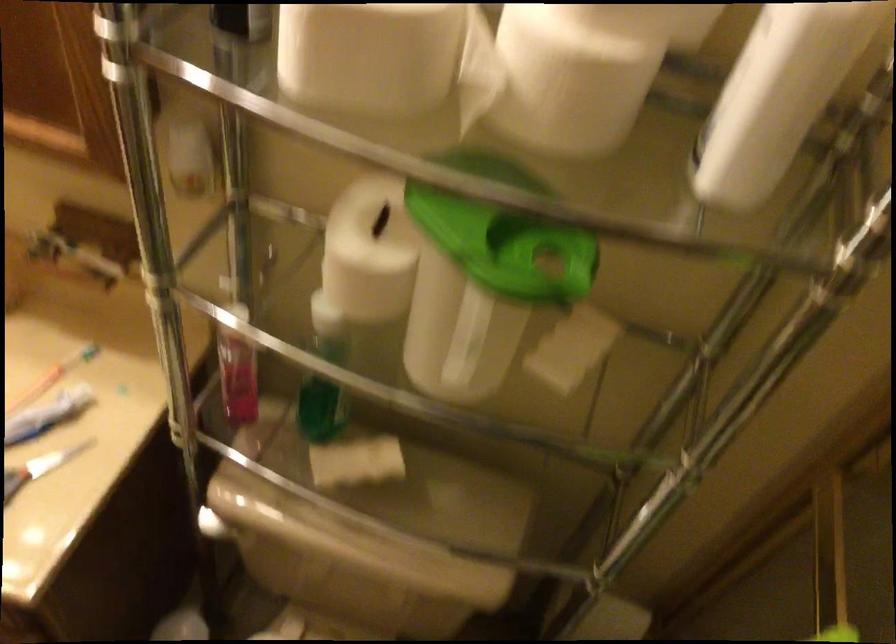
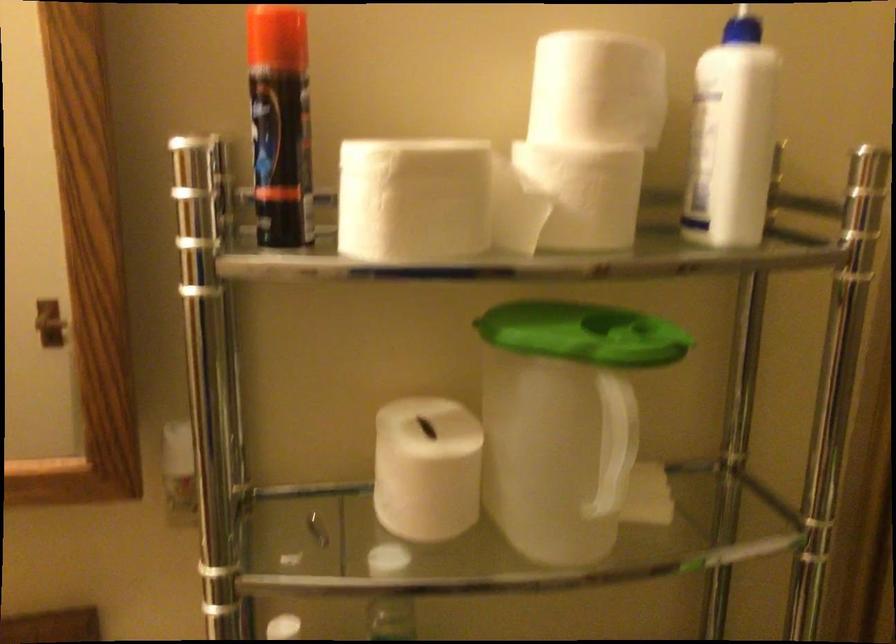
The point at (x=554, y=79) is marked in the first image. Where is the corresponding point in the second image?

(588, 194)